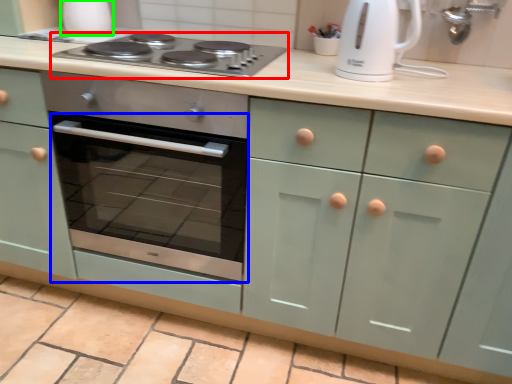
Question: Estimate the real-world distances between objects in this image. Which object is farther from gas stove (highlighted by a red box), oven (highlighted by a blue box) or appliance (highlighted by a green box)?

Choices:
 (A) oven
 (B) appliance

Answer: (A)